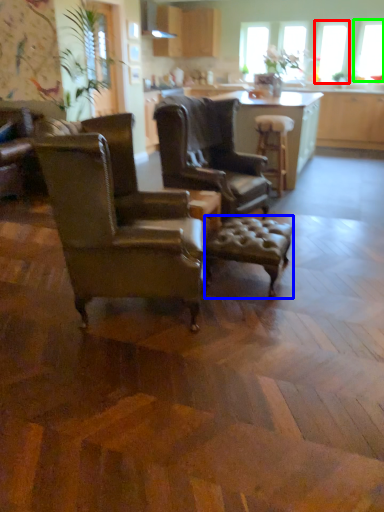
Question: Which is nearer to the window screen (highlighted by a red box)? stool (highlighted by a blue box) or window screen (highlighted by a green box).

Choices:
 (A) stool
 (B) window screen

Answer: (B)